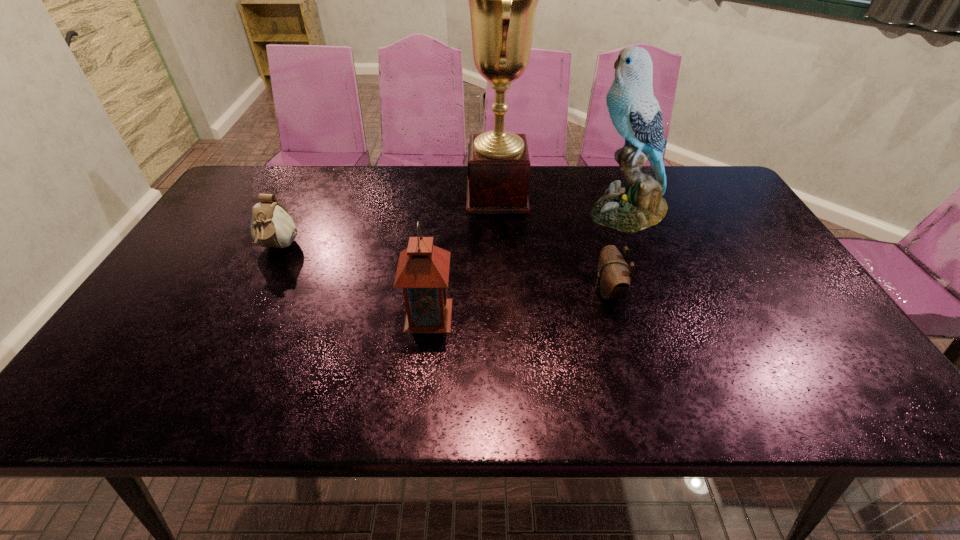
Identify the location of vacant region that satisfies the following two spatial constraints: 1. on the plaque of the tallest object; 2. on the front side of the second object from left to right. (503, 315).

Image resolution: width=960 pixels, height=540 pixels. In order to click on free spot that satisfies the following two spatial constraints: 1. on the face of the parakeet; 2. on the front-facing side of the farther pouch in this screenshot , I will do `click(641, 248)`.

Locate an element on the screen. free space that satisfies the following two spatial constraints: 1. on the front-facing side of the second shortest object; 2. on the left side of the fourth object from right to left is located at coordinates (244, 315).